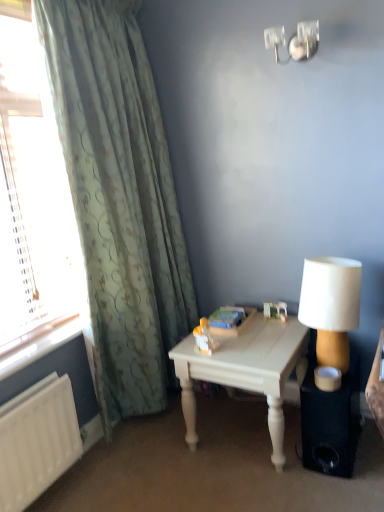
Question: Considering the relative sizes of black matte speaker at lower right and clear glass window at left in the image provided, is black matte speaker at lower right bigger than clear glass window at left?

Choices:
 (A) no
 (B) yes

Answer: (A)

Question: Considering the relative sizes of black matte speaker at lower right and clear glass window at left in the image provided, is black matte speaker at lower right thinner than clear glass window at left?

Choices:
 (A) no
 (B) yes

Answer: (A)

Question: Is clear glass window at left inside black matte speaker at lower right?

Choices:
 (A) yes
 (B) no

Answer: (B)

Question: Is black matte speaker at lower right beside clear glass window at left?

Choices:
 (A) no
 (B) yes

Answer: (A)

Question: Is black matte speaker at lower right looking in the opposite direction of clear glass window at left?

Choices:
 (A) yes
 (B) no

Answer: (B)

Question: Is black matte speaker at lower right closer to camera compared to clear glass window at left?

Choices:
 (A) yes
 (B) no

Answer: (B)

Question: From a real-world perspective, is green textured curtain at left on top of black matte speaker at lower right?

Choices:
 (A) yes
 (B) no

Answer: (A)

Question: Does green textured curtain at left come in front of black matte speaker at lower right?

Choices:
 (A) yes
 (B) no

Answer: (A)

Question: Is green textured curtain at left located outside black matte speaker at lower right?

Choices:
 (A) yes
 (B) no

Answer: (A)

Question: Is green textured curtain at left far from black matte speaker at lower right?

Choices:
 (A) no
 (B) yes

Answer: (B)

Question: Considering the relative sizes of green textured curtain at left and black matte speaker at lower right in the image provided, is green textured curtain at left taller than black matte speaker at lower right?

Choices:
 (A) no
 (B) yes

Answer: (B)

Question: Is green textured curtain at left turned away from black matte speaker at lower right?

Choices:
 (A) no
 (B) yes

Answer: (A)

Question: Could you tell me if clear glass window at left is facing white painted wood table at center?

Choices:
 (A) yes
 (B) no

Answer: (B)